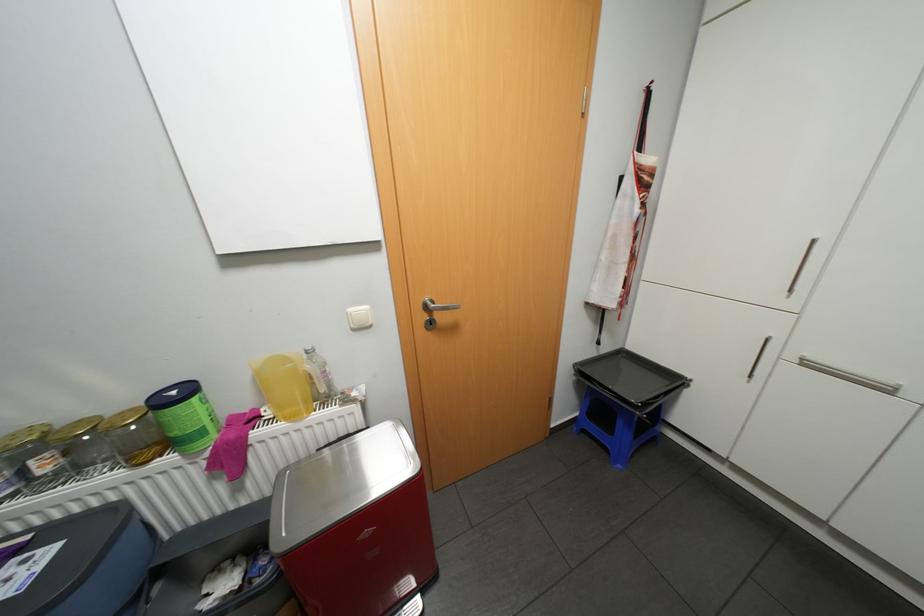
Locate an element on the screen. Image resolution: width=924 pixels, height=616 pixels. green plastic container is located at coordinates (185, 416).